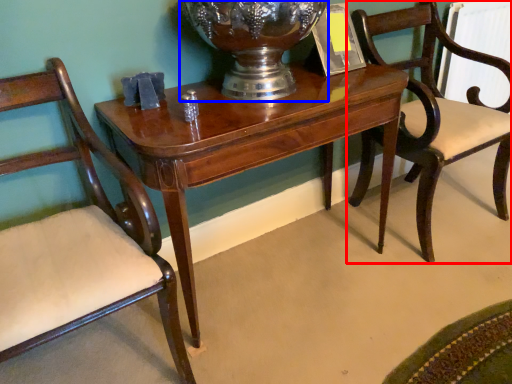
Question: Which point is further to the camera, chair (highlighted by a red box) or glass vase (highlighted by a blue box)?

Choices:
 (A) chair
 (B) glass vase

Answer: (A)